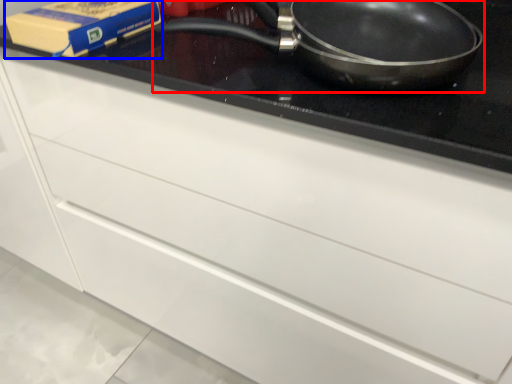
Question: Which object appears farthest to the camera in this image, frying pan (highlighted by a red box) or paperback book (highlighted by a blue box)?

Choices:
 (A) frying pan
 (B) paperback book

Answer: (B)